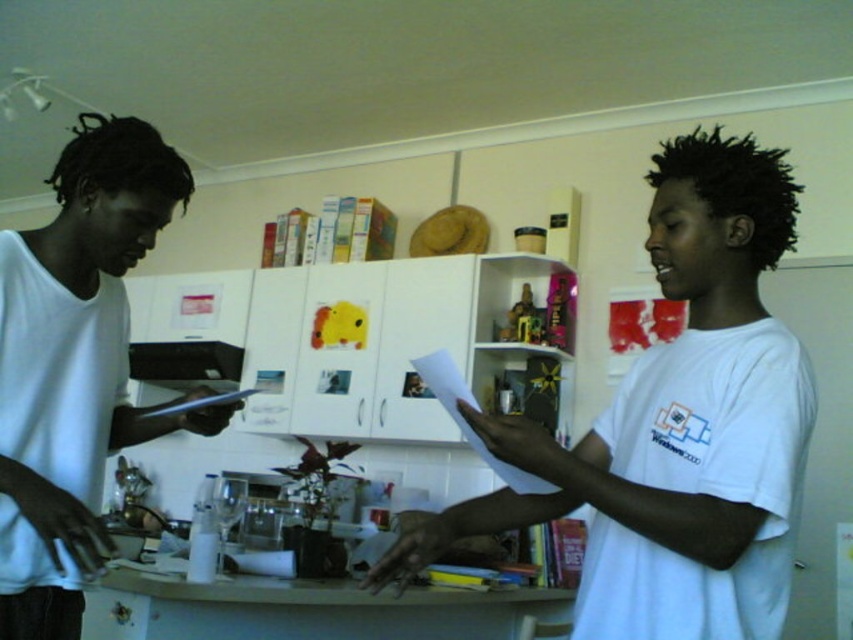
Who is lower down, black hair at center or black plastic exhaust hood at upper center?

Positioned lower is black plastic exhaust hood at upper center.

Does black hair at center have a greater height compared to black plastic exhaust hood at upper center?

Yes.

Measure the distance between black hair at center and camera.

3.95 feet

This screenshot has width=853, height=640. I want to click on black hair at center, so click(x=735, y=186).

Is white matte shirt at left to the right of black hair at center from the viewer's perspective?

In fact, white matte shirt at left is to the left of black hair at center.

Does point (68, 582) come behind point (722, 196)?

Yes, it is.

Where is `white matte shirt at left`? white matte shirt at left is located at coordinates (74, 365).

Identify the location of white matte shirt at left. (74, 365).

Can you confirm if white matte shirt at left is taller than black plastic exhaust hood at upper center?

Yes.

Is point (38, 241) less distant than point (206, 378)?

Yes.

Identify the location of white matte shirt at left. (74, 365).